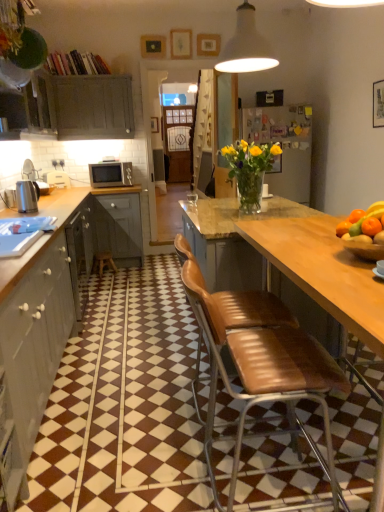
Question: Are matte gray cabinet at left, placed as the 3th cabinetry when sorted from front to back, and white matte pendant lamp at upper center far apart?

Choices:
 (A) no
 (B) yes

Answer: (B)

Question: From the image's perspective, is matte gray cabinet at left, the first cabinetry positioned from the top, on top of white matte pendant lamp at upper center?

Choices:
 (A) no
 (B) yes

Answer: (B)

Question: Does matte gray cabinet at left, which ranks as the first cabinetry in back-to-front order, appear on the left side of white matte pendant lamp at upper center?

Choices:
 (A) yes
 (B) no

Answer: (A)

Question: Can you confirm if matte gray cabinet at left, positioned as the 3th cabinetry in bottom-to-top order, is shorter than white matte pendant lamp at upper center?

Choices:
 (A) no
 (B) yes

Answer: (A)

Question: From the image's perspective, would you say matte gray cabinet at left, which ranks as the first cabinetry in back-to-front order, is shown under white matte pendant lamp at upper center?

Choices:
 (A) yes
 (B) no

Answer: (B)

Question: Is matte gray cabinet at left, placed as the 3th cabinetry when sorted from front to back, wider than white matte pendant lamp at upper center?

Choices:
 (A) no
 (B) yes

Answer: (A)

Question: Is the depth of matte gray cabinet at left, which ranks as the first cabinetry in back-to-front order, greater than that of silver metallic microwave at left?

Choices:
 (A) no
 (B) yes

Answer: (A)

Question: Is matte gray cabinet at left, placed as the 3th cabinetry when sorted from front to back, far from silver metallic microwave at left?

Choices:
 (A) yes
 (B) no

Answer: (B)

Question: Can you confirm if matte gray cabinet at left, placed as the 3th cabinetry when sorted from front to back, is positioned to the right of silver metallic microwave at left?

Choices:
 (A) no
 (B) yes

Answer: (A)

Question: Is matte gray cabinet at left, the first cabinetry positioned from the top, facing away from silver metallic microwave at left?

Choices:
 (A) yes
 (B) no

Answer: (B)

Question: Is matte gray cabinet at left, the first cabinetry positioned from the top, directly adjacent to silver metallic microwave at left?

Choices:
 (A) yes
 (B) no

Answer: (B)

Question: Is matte gray cabinet at left, the first cabinetry positioned from the top, closer to the viewer compared to silver metallic microwave at left?

Choices:
 (A) yes
 (B) no

Answer: (A)

Question: Is wooden picture frame at upper center inside matte gray cabinets at left, which is the 1th cabinetry from front to back?

Choices:
 (A) no
 (B) yes

Answer: (A)